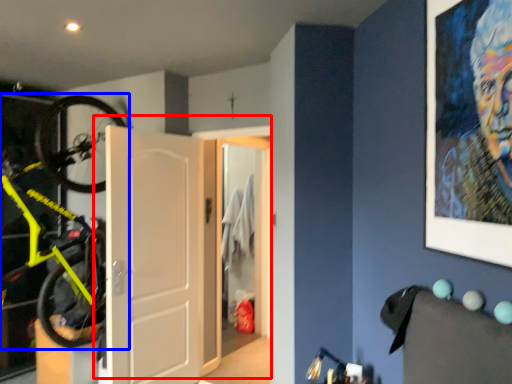
Question: Which of the following is the closest to the observer, door (highlighted by a red box) or bicycle (highlighted by a blue box)?

Choices:
 (A) door
 (B) bicycle

Answer: (B)